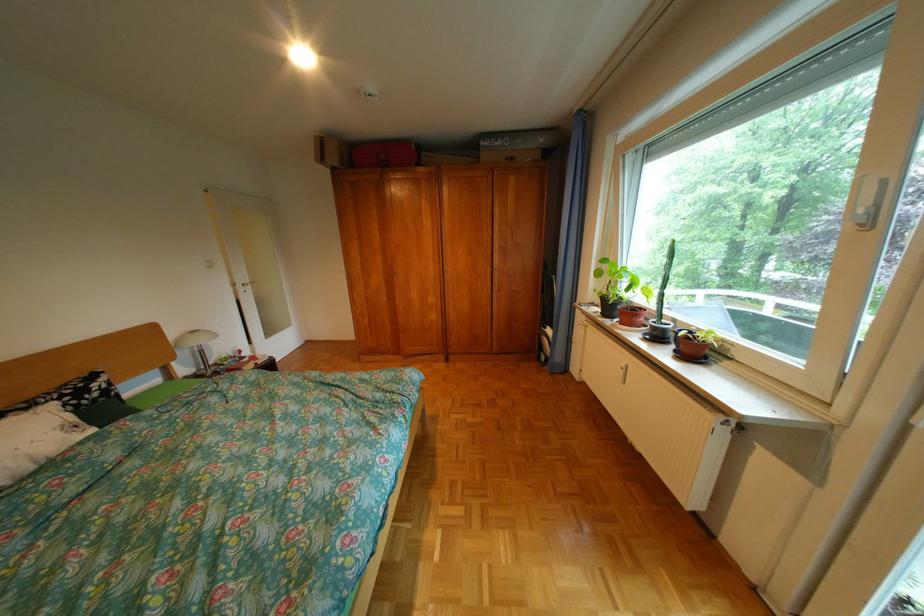
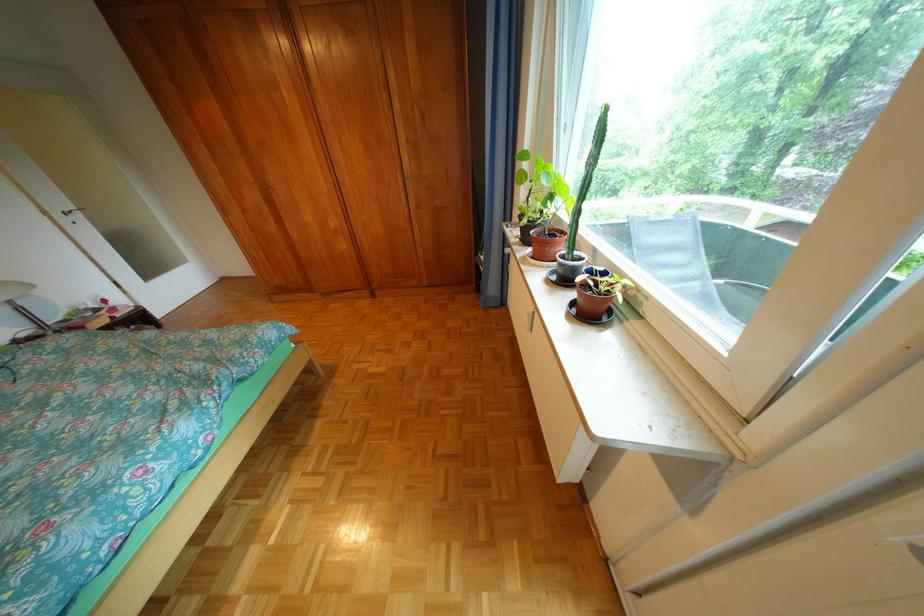
Locate, in the second image, the point that corresponds to [253,286] in the first image.

(73, 216)